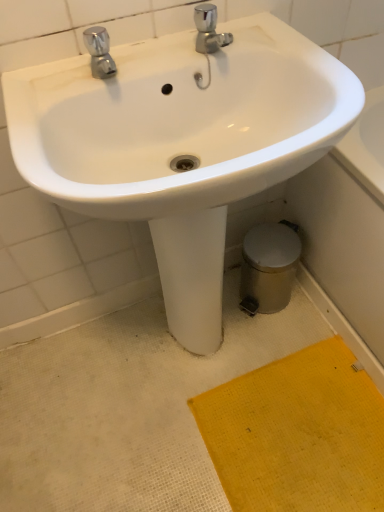
Locate an element on the screen. vacant space that's between white glossy sink at center and yellow textured mat at lower right is located at coordinates (195, 437).